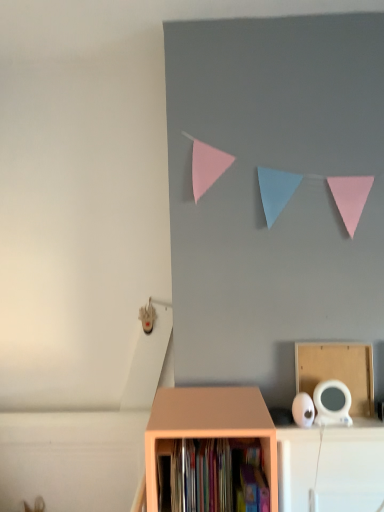
Question: Is matte wood shelf at lower center in front of cardboard at upper right?

Choices:
 (A) yes
 (B) no

Answer: (A)

Question: From the image's perspective, is matte wood shelf at lower center below cardboard at upper right?

Choices:
 (A) no
 (B) yes

Answer: (B)

Question: Is matte wood shelf at lower center next to cardboard at upper right?

Choices:
 (A) no
 (B) yes

Answer: (A)

Question: Does matte wood shelf at lower center have a greater height compared to cardboard at upper right?

Choices:
 (A) yes
 (B) no

Answer: (A)

Question: Does matte wood shelf at lower center appear on the right side of cardboard at upper right?

Choices:
 (A) yes
 (B) no

Answer: (B)

Question: Considering the positions of cardboard at upper right and matte wood shelf at lower center in the image, is cardboard at upper right taller or shorter than matte wood shelf at lower center?

Choices:
 (A) tall
 (B) short

Answer: (B)

Question: From a real-world perspective, is cardboard at upper right positioned above or below matte wood shelf at lower center?

Choices:
 (A) below
 (B) above

Answer: (B)

Question: Looking at the image, does cardboard at upper right seem bigger or smaller compared to matte wood shelf at lower center?

Choices:
 (A) small
 (B) big

Answer: (A)

Question: Is cardboard at upper right in front of or behind matte wood shelf at lower center in the image?

Choices:
 (A) front
 (B) behind

Answer: (B)

Question: In terms of height, does matte wood shelf at lower center look taller or shorter compared to cardboard at upper right?

Choices:
 (A) tall
 (B) short

Answer: (A)

Question: Is point (147, 480) closer or farther from the camera than point (357, 373)?

Choices:
 (A) farther
 (B) closer

Answer: (B)

Question: Considering the positions of matte wood shelf at lower center and cardboard at upper right in the image, is matte wood shelf at lower center wider or thinner than cardboard at upper right?

Choices:
 (A) wide
 (B) thin

Answer: (A)

Question: Which is correct: matte wood shelf at lower center is inside cardboard at upper right, or outside of it?

Choices:
 (A) inside
 (B) outside

Answer: (B)

Question: Considering their positions, is cardboard at upper right located in front of or behind hardcover books at center?

Choices:
 (A) front
 (B) behind

Answer: (B)

Question: In the image, is cardboard at upper right on the left side or the right side of hardcover books at center?

Choices:
 (A) right
 (B) left

Answer: (A)